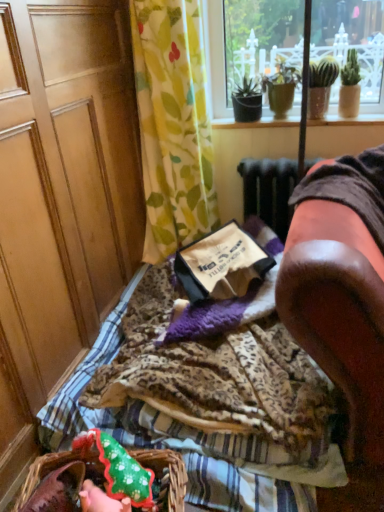
Identify the location of vacant space in front of brown paper bag at center. Image resolution: width=384 pixels, height=512 pixels. (223, 365).